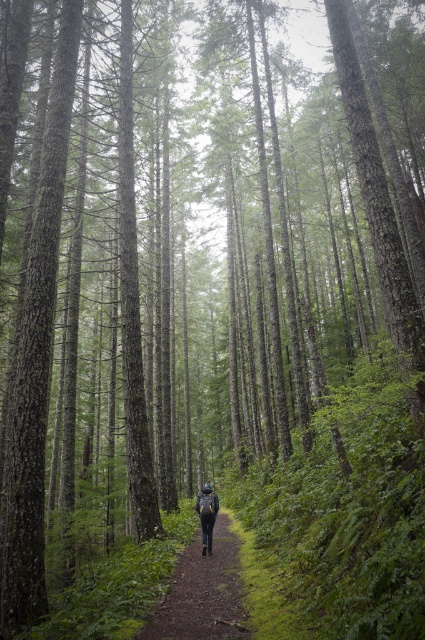
You are a hiker who just arrived at the forest and see the brown dirt path at center and the matte black backpack at center. You want to place your 1.8 meter long tent on the ground. Can you fit the tent between them without moving either object?

The distance between the brown dirt path at center and the matte black backpack at center is 2.03 meters. Since the tent is 1.8 meters long, it can fit between them as there is enough space.

You are a hiker who just arrived at the forest and see the brown dirt path at center and the matte black backpack at center. Which object is positioned to the right of the other?

The brown dirt path at center is to the right of the matte black backpack at center.

You are a hiker who wants to place your matte black backpack at center on the brown dirt path at center. Based on the scene description, will the backpack fit on the path without any part of it hanging off the edges?

The brown dirt path at center is much taller than the matte black backpack at center, so the backpack will fit comfortably on the path without any part hanging off the edges.